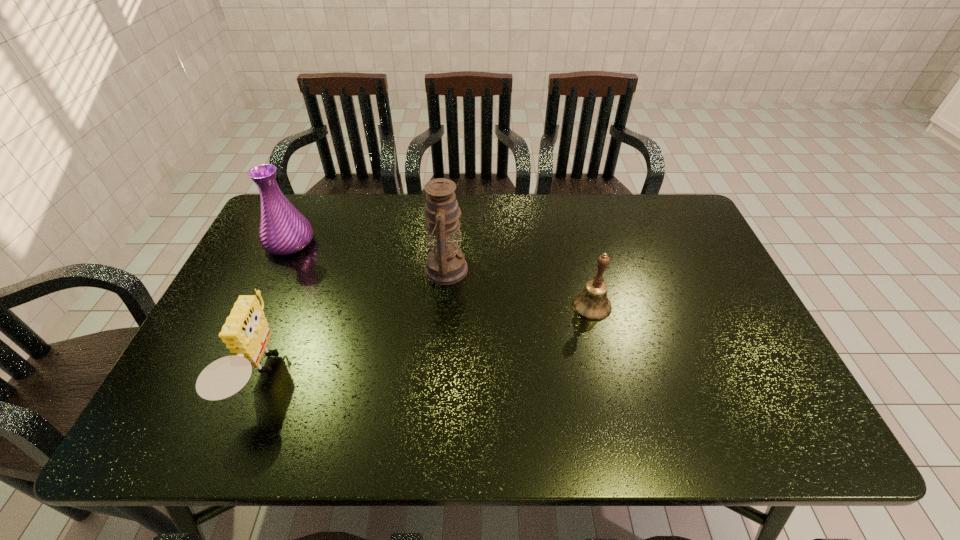
This screenshot has height=540, width=960. Find the location of `free spot that satisfies the following two spatial constraints: 1. on the front side of the oil lamp; 2. on the front-facing side of the sponge`. free spot that satisfies the following two spatial constraints: 1. on the front side of the oil lamp; 2. on the front-facing side of the sponge is located at coordinates (435, 375).

I want to click on blank space that satisfies the following two spatial constraints: 1. on the front side of the vase; 2. on the right side of the oil lamp, so click(x=277, y=269).